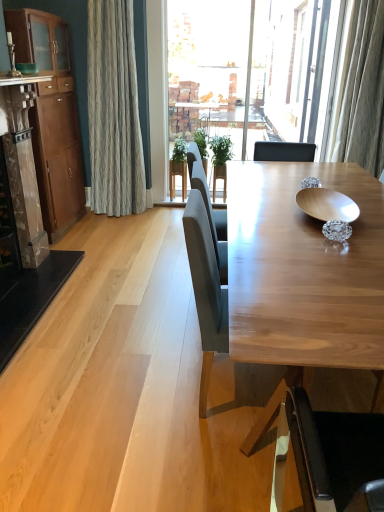
Identify the location of free point in front of matte gray chair at center, the 1th chair viewed from the back. (206, 471).